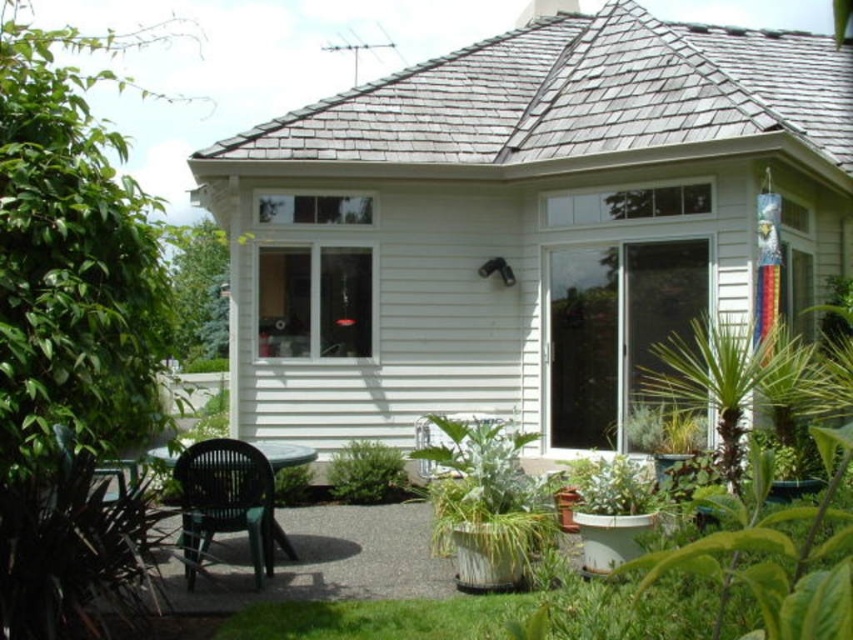
Between black plastic chair at lower left and green leafy plant at lower center, which one is positioned higher?

black plastic chair at lower left is above.

Does black plastic chair at lower left appear over green leafy plant at lower center?

Yes, black plastic chair at lower left is above green leafy plant at lower center.

Locate an element on the screen. The width and height of the screenshot is (853, 640). black plastic chair at lower left is located at coordinates (225, 500).

From the picture: Who is lower down, green metallic pot at lower center or green leafy plant at center?

green leafy plant at center is below.

Is point (434, 541) positioned behind point (381, 445)?

That is False.

Is point (500, 572) more distant than point (389, 448)?

No, (500, 572) is in front of (389, 448).

You are a GUI agent. You are given a task and a screenshot of the screen. Output one action in this format:
    pyautogui.click(x=<x>, y=<y>)
    Task: Click on the green metallic pot at lower center
    This screenshot has height=640, width=853.
    Given the screenshot: What is the action you would take?
    coord(485,502)

Does white siding at center appear under black plastic chair at lower left?

Incorrect, white siding at center is not positioned below black plastic chair at lower left.

Does white siding at center appear on the right side of black plastic chair at lower left?

Yes, white siding at center is to the right of black plastic chair at lower left.

Identify the location of white siding at center. (523, 221).

Identify the location of white siding at center. The width and height of the screenshot is (853, 640). (523, 221).